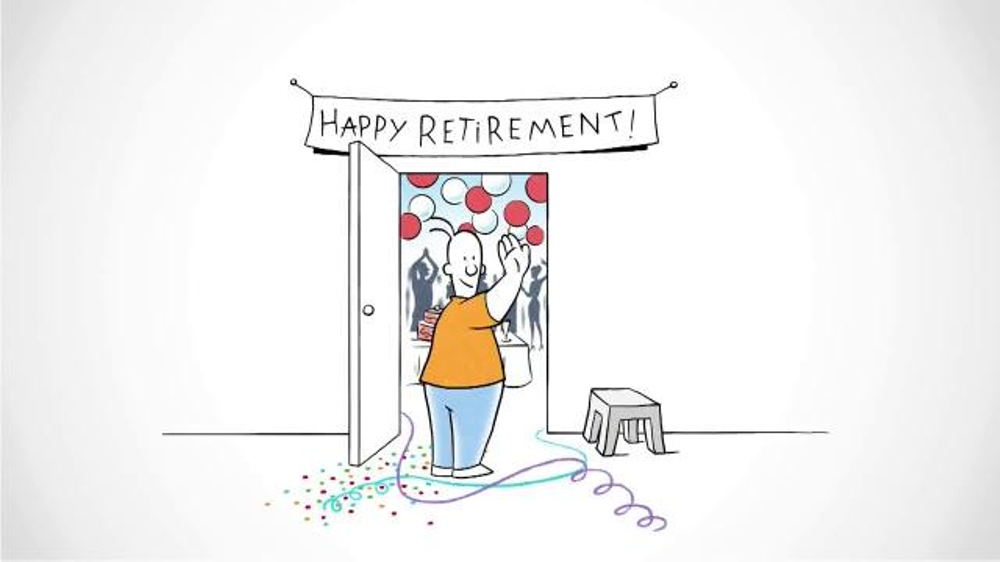
The width and height of the screenshot is (1000, 562). In order to click on "happy retirement" banner in this screenshot , I will do `click(294, 78)`, `click(355, 108)`, `click(397, 126)`, `click(517, 130)`, `click(623, 143)`, `click(649, 98)`.